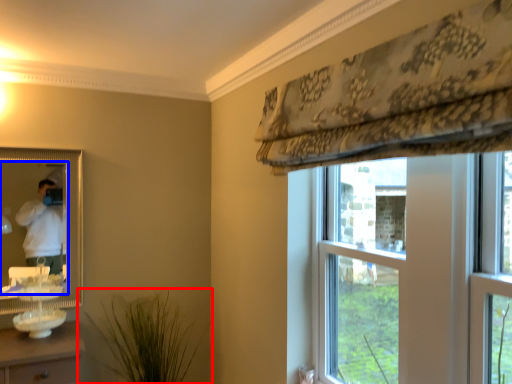
Question: Which point is further to the camera, houseplant (highlighted by a red box) or mirror (highlighted by a blue box)?

Choices:
 (A) houseplant
 (B) mirror

Answer: (B)